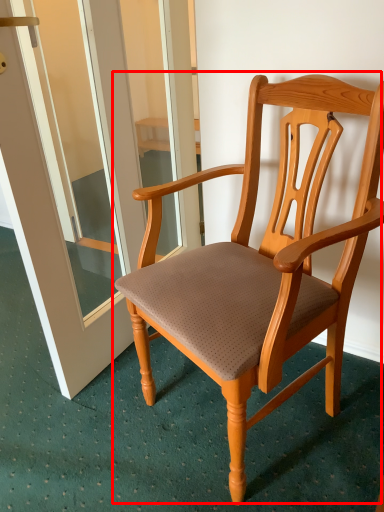
Question: From the image, what is the correct spatial relationship of chair (annotated by the red box) in relation to screen door?

Choices:
 (A) left
 (B) right

Answer: (B)